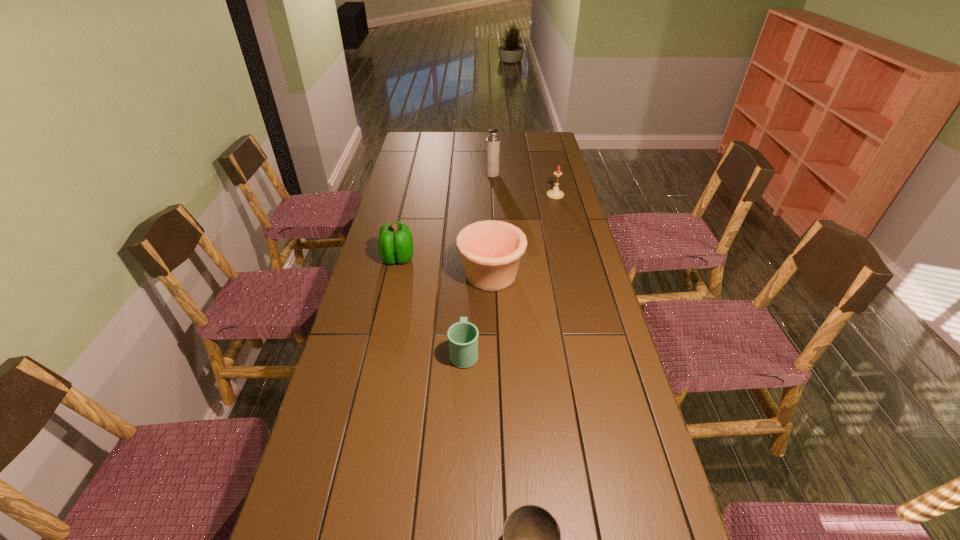
Identify the location of the farthest object. Image resolution: width=960 pixels, height=540 pixels. (493, 141).

I want to click on the tallest object, so click(493, 141).

Find the location of a particular element. pottery is located at coordinates (491, 250).

Locate an element on the screen. Image resolution: width=960 pixels, height=540 pixels. the leftmost object is located at coordinates (395, 243).

This screenshot has height=540, width=960. I want to click on the second farthest object, so click(555, 193).

You are a GUI agent. You are given a task and a screenshot of the screen. Output one action in this format:
    pyautogui.click(x=<x>, y=<y>)
    Task: Click on the candle
    The width and height of the screenshot is (960, 540).
    Given the screenshot: What is the action you would take?
    pyautogui.click(x=555, y=193)

Locate an element on the screen. mug is located at coordinates (462, 336).

Where is `the second shortest object`? the second shortest object is located at coordinates (462, 336).

At what (x,y) coordinates should I click in order to perform the action: click on vacant space positioned on the back of the thermos bottle. Please return your answer as a coordinate pair (x, y). The image size is (960, 540). Looking at the image, I should click on (x=492, y=143).

Where is `free space located 0.180m on the back of the pottery`? free space located 0.180m on the back of the pottery is located at coordinates (490, 228).